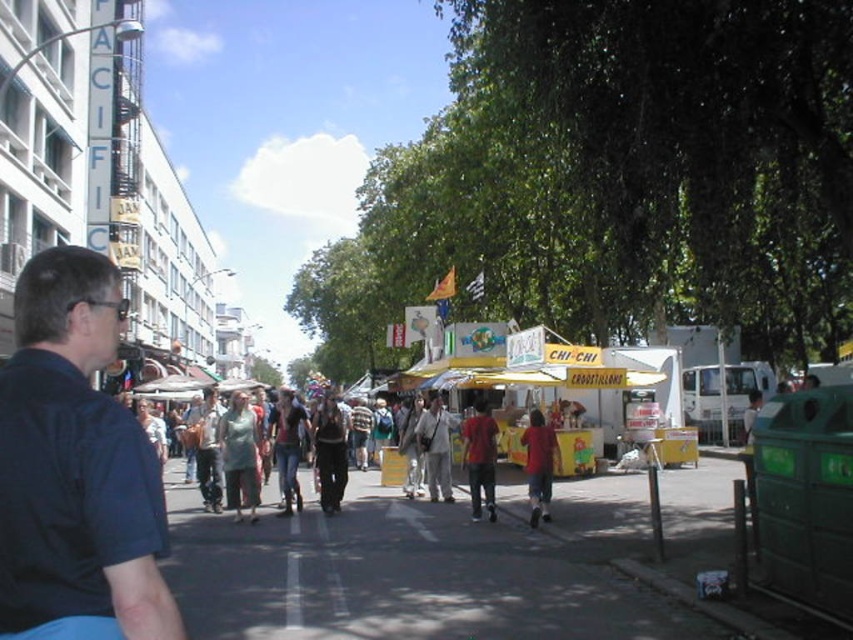
You are standing on the street depicted in the image. There is a red matte shirt at center located at point (480, 458). If you want to buy food from the nearest food stall with a bright yellow canopy, which direction should you face?

The red matte shirt at center is located at point (480, 458). The nearest food stall with a bright yellow canopy is to the left of the red matte shirt at center, so you should face left.

You are a photographer standing in the middle of the street. You notice two people wearing a dark blue shirt at left and a matte red shirt at center. If you want to take a photo that includes both shirts, which shirt should you focus on to ensure both are in frame?

You should focus on the matte red shirt at center because the dark blue shirt at left is shorter than it, so keeping the matte red shirt at center in focus will naturally include the shorter dark blue shirt at left within the frame.

You are a delivery person standing on the dark gray asphalt at center and need to deliver a package to the person wearing the dark blue shirt at left. Can you walk directly to them without stepping off the asphalt?

The dark gray asphalt at center might be wider than dark blue shirt at left, so it is possible that the dark gray asphalt at center is wide enough to allow you to walk directly to the dark blue shirt at left without needing to step off the asphalt.